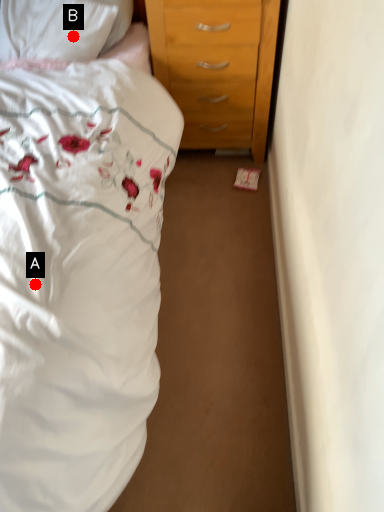
Question: Two points are circled on the image, labeled by A and B beside each circle. Which point is closer to the camera?

Choices:
 (A) A is closer
 (B) B is closer

Answer: (A)